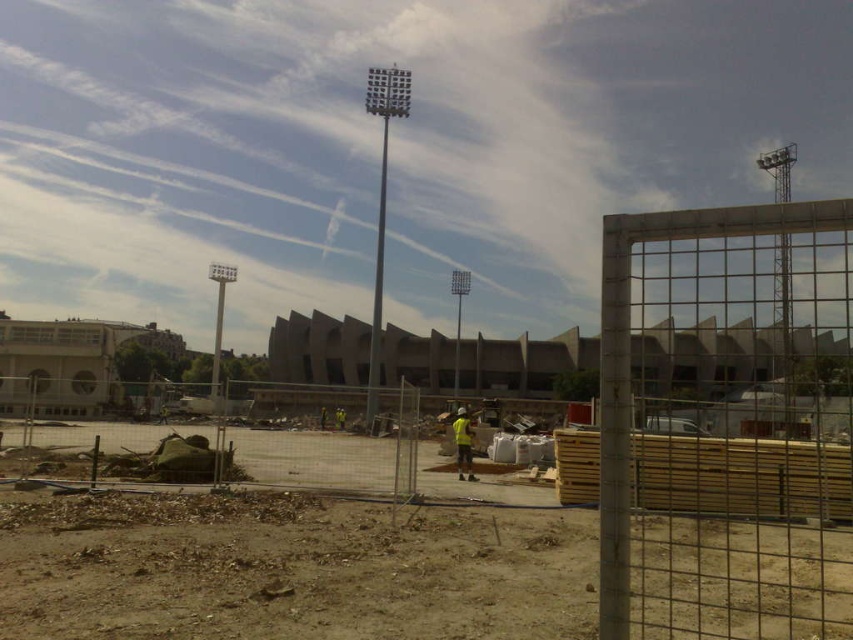
You are a safety inspector at the construction site. You notice the metal mesh fence at center and the yellow reflective vest at center. According to safety regulations, the fence must be positioned at the same level as the vest to ensure visibility. Is the current setup compliant with these regulations?

The metal mesh fence at center is located above the yellow reflective vest at center, so the current setup is not compliant with the safety regulations since the fence is not at the same level as the vest.

You are a safety inspector at the construction site. You notice the metal mesh fence at center and the yellow reflective vest at center. According to safety protocols, which object should be closer to the workers to ensure visibility?

The yellow reflective vest at center should be closer to the workers because the metal mesh fence at center is in front of it, meaning the vest is positioned behind the fence and farther from the workers.

You are a safety inspector checking the construction site. You notice the metal mesh fence at center and the yellow reflective vest at center. Based on their positions, which object is more likely to block a worker from being seen by a passing crane operator?

The metal mesh fence at center is wider than the yellow reflective vest at center, so it is more likely to block the worker from being seen by the crane operator.